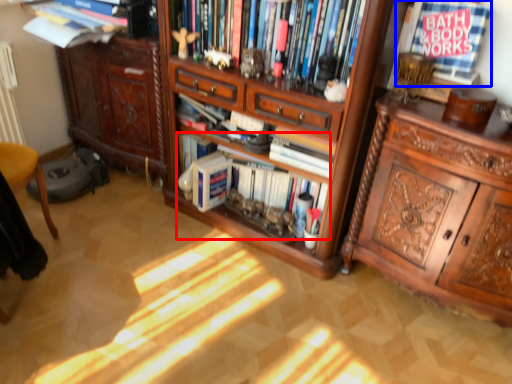
Question: Which point is closer to the camera, book (highlighted by a red box) or book (highlighted by a blue box)?

Choices:
 (A) book
 (B) book

Answer: (B)